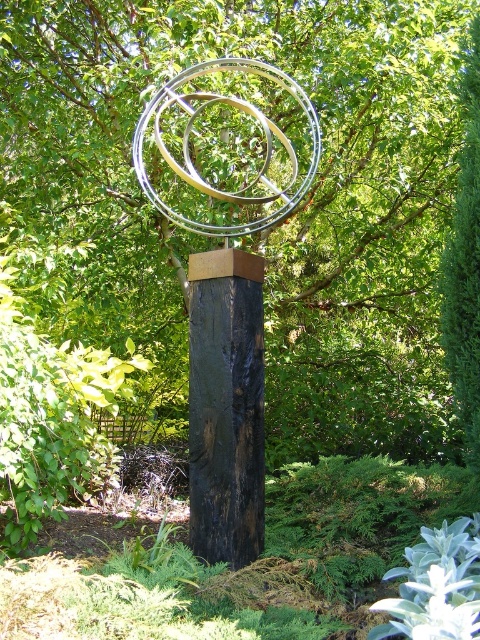
What do you see at coordinates (261, 234) in the screenshot? I see `green leafy tree at center` at bounding box center [261, 234].

Does green leafy tree at center have a lesser width compared to metallic rings at center?

No.

Who is more forward, (279, 392) or (186, 100)?

Positioned in front is point (186, 100).

Where is `green leafy tree at center`? Image resolution: width=480 pixels, height=640 pixels. green leafy tree at center is located at coordinates (261, 234).

Can you confirm if green leafy tree at center is taller than black wood post at center?

Correct, green leafy tree at center is much taller as black wood post at center.

In the scene shown: Who is more distant from viewer, [417,449] or [240,304]?

The point [417,449] is behind.

At what (x,y) coordinates should I click in order to perform the action: click on green leafy tree at center. Please return your answer as a coordinate pair (x, y). Looking at the image, I should click on (261, 234).

Who is more forward, [208,464] or [186,132]?

Positioned in front is point [208,464].

Is point (319, 136) farther from camera compared to point (252, 61)?

Yes, it is.

Which is in front, point (257, 225) or point (162, 104)?

Point (257, 225)

Find the location of a particular element. metallic rings at center is located at coordinates (226, 404).